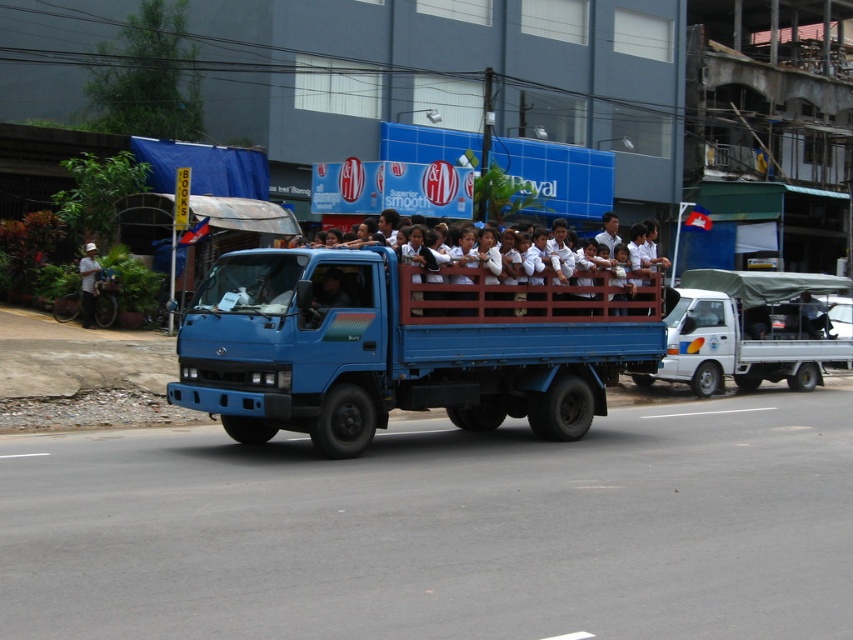
Question: Which object is the farthest from the blue metallic truck at center?

Choices:
 (A) white matte uniform at center
 (B) white matte truck at center

Answer: (B)

Question: Estimate the real-world distances between objects in this image. Which object is farther from the white matte truck at center?

Choices:
 (A) white matte uniform at center
 (B) blue metallic truck at center

Answer: (B)

Question: Which of the following is the farthest from the observer?

Choices:
 (A) blue metallic truck at center
 (B) white matte uniform at center
 (C) white matte truck at center

Answer: (C)

Question: Can you confirm if white matte truck at center is positioned to the left of white matte uniform at center?

Choices:
 (A) no
 (B) yes

Answer: (A)

Question: From the image, what is the correct spatial relationship of blue metallic truck at center in relation to white matte truck at center?

Choices:
 (A) above
 (B) below

Answer: (B)

Question: Is blue metallic truck at center positioned before white matte uniform at center?

Choices:
 (A) yes
 (B) no

Answer: (A)